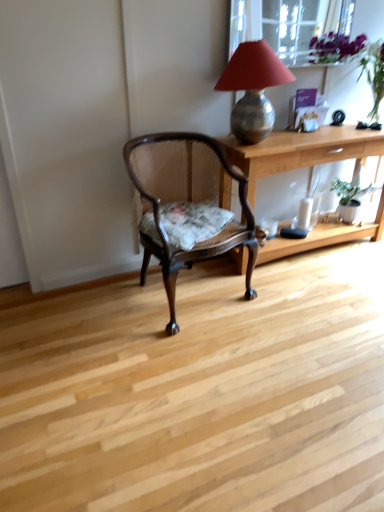
Question: From the image's perspective, is transparent glass window screen at upper center located above or below light wood desk at center?

Choices:
 (A) above
 (B) below

Answer: (A)

Question: In terms of width, does transparent glass window screen at upper center look wider or thinner when compared to light wood desk at center?

Choices:
 (A) wide
 (B) thin

Answer: (B)

Question: Estimate the real-world distances between objects in this image. Which object is farther from the transparent glass window screen at upper center?

Choices:
 (A) metallic textured lamp at upper right
 (B) light wood desk at center
 (C) mahogany cane chair at center
 (D) green matte houseplant at right

Answer: (C)

Question: Which object is the farthest from the transparent glass window screen at upper center?

Choices:
 (A) mahogany cane chair at center
 (B) green matte houseplant at right
 (C) light wood desk at center
 (D) metallic textured lamp at upper right

Answer: (A)